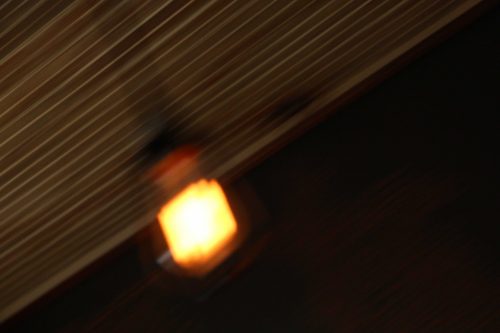
You are a GUI agent. You are given a task and a screenshot of the screen. Output one action in this format:
    pyautogui.click(x=<x>, y=<y>)
    Task: Click on the yellow light
    
    Given the screenshot: What is the action you would take?
    pyautogui.click(x=195, y=223)